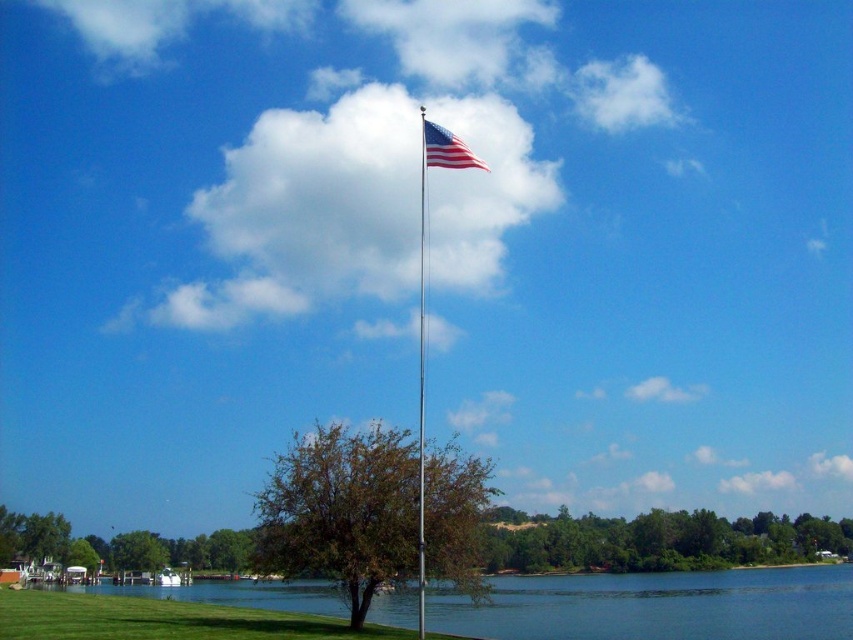
Is brown textured tree at center shorter than silver metallic flag pole at center?

Yes.

Between brown textured tree at center and silver metallic flag pole at center, which one has less height?

Standing shorter between the two is brown textured tree at center.

Where is `brown textured tree at center`? brown textured tree at center is located at coordinates (341, 509).

This screenshot has height=640, width=853. I want to click on brown textured tree at center, so click(x=341, y=509).

The image size is (853, 640). Describe the element at coordinates (654, 605) in the screenshot. I see `green grass at lower left` at that location.

Which is in front, point (561, 608) or point (450, 548)?

Point (450, 548)

Identify the location of green grass at lower left. (654, 605).

Is green leafy tree at lower left positioned in front of silver metallic flag pole at center?

No.

This screenshot has height=640, width=853. Identify the location of green leafy tree at lower left. (117, 545).